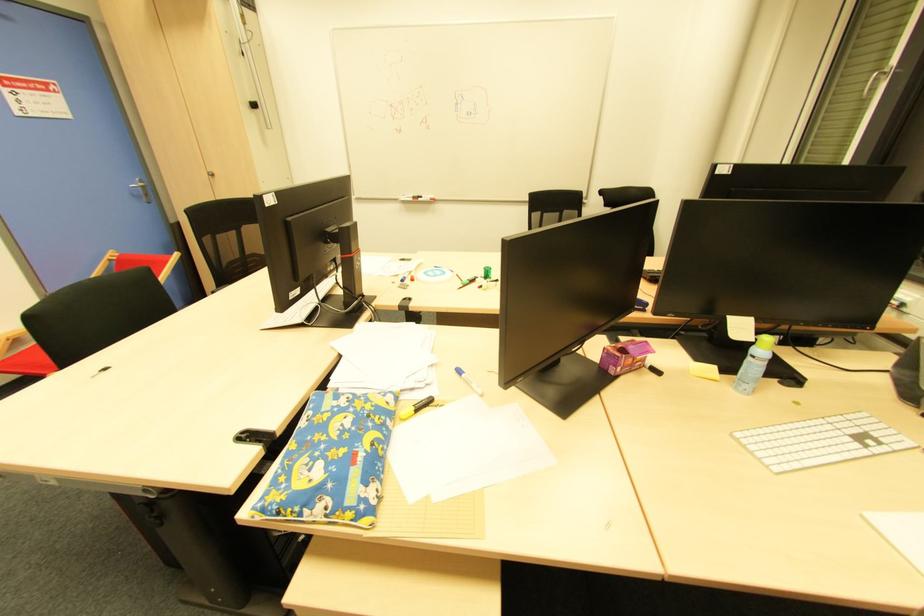
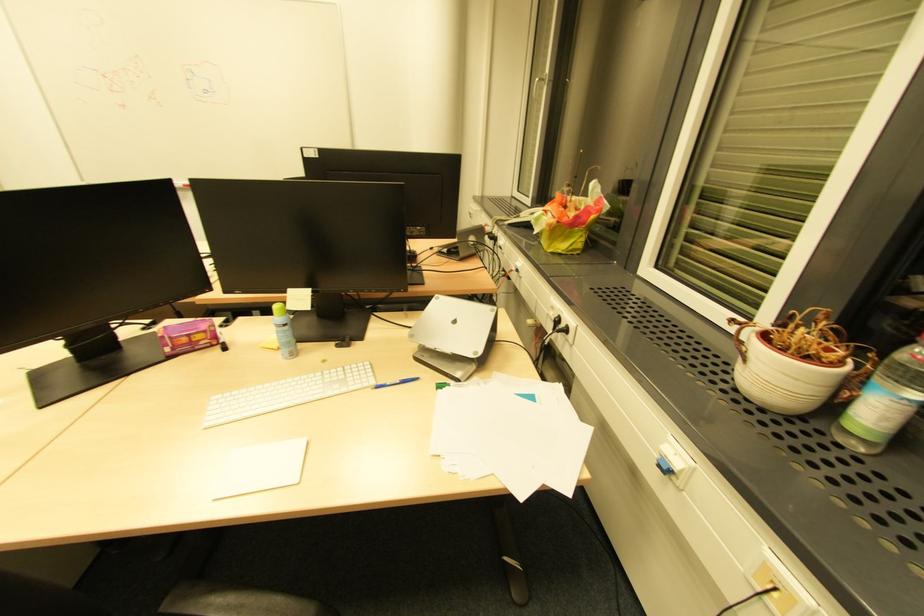
Locate, in the second image, the point that corresponds to the point at 877,75 in the first image.

(536, 81)